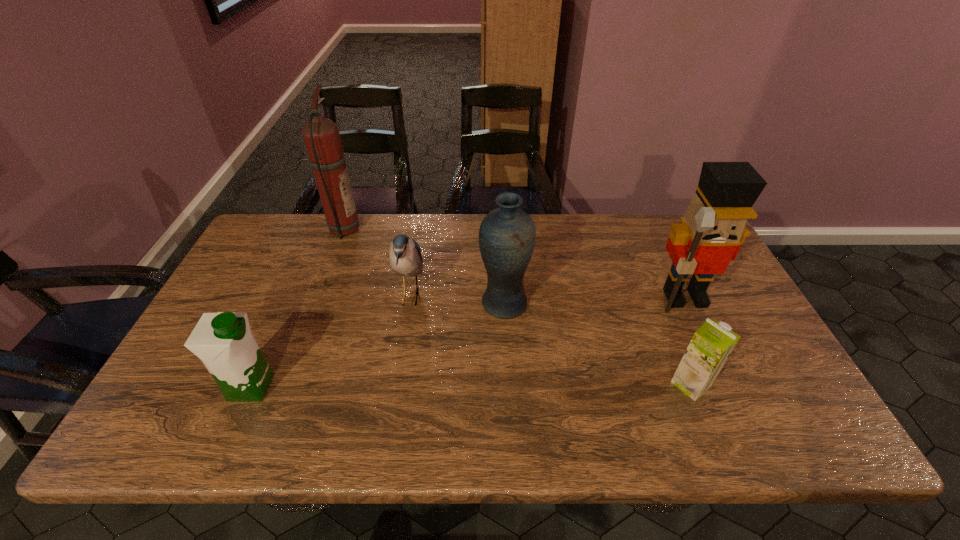
Where is `free space located at the tip of the third object from left to right's beak`? The height and width of the screenshot is (540, 960). free space located at the tip of the third object from left to right's beak is located at coordinates (488, 296).

Find the location of a particular element. The width and height of the screenshot is (960, 540). free space located on the right of the right soya milk is located at coordinates (760, 384).

Identify the location of object at the far edge. Image resolution: width=960 pixels, height=540 pixels. (321, 135).

Locate an element on the screen. object that is at the left edge is located at coordinates (223, 341).

This screenshot has height=540, width=960. I want to click on object located at the right edge, so click(x=712, y=230).

Where is `free space at the far edge`? This screenshot has height=540, width=960. free space at the far edge is located at coordinates click(414, 237).

In the image, there is a desktop. Find the location of `vacant region at the near edge`. vacant region at the near edge is located at coordinates (346, 430).

Find the location of a particular element. Image resolution: width=960 pixels, height=540 pixels. blank space at the right edge of the desktop is located at coordinates (761, 341).

Where is `vacant area at the far left corner of the desktop`? The height and width of the screenshot is (540, 960). vacant area at the far left corner of the desktop is located at coordinates (280, 217).

The height and width of the screenshot is (540, 960). What are the coordinates of `vacant space at the near left corner` in the screenshot? It's located at (202, 418).